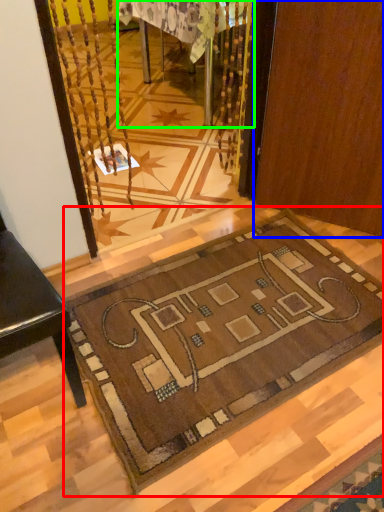
Question: Based on their relative distances, which object is nearer to mat (highlighted by a red box)? Choose from door (highlighted by a blue box) and table (highlighted by a green box).

Choices:
 (A) door
 (B) table

Answer: (A)